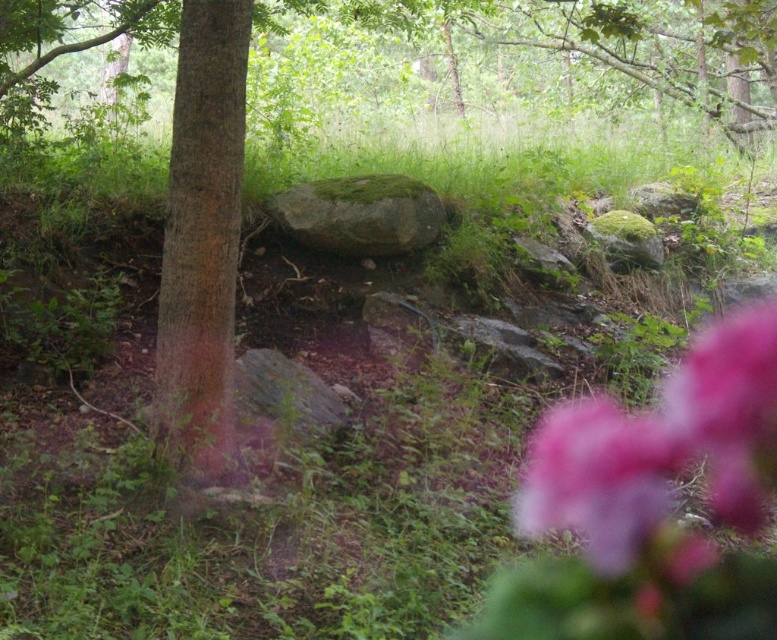
You are a photographer who wants to capture both the pink fuzzy flower at lower right and the pink fluffy flower at lower right in a single frame. Which flower should you focus on to ensure both are in focus?

To ensure both the pink fuzzy flower at lower right and the pink fluffy flower at lower right are in focus, you should focus on the pink fuzzy flower at lower right since it is taller and will require a greater depth of field.

Consider the image. You are a hiker carrying a backpack and want to place your water bottle between the brown rough bark tree at center and the green mossy rock at center. Is there enough space to place it there?

The brown rough bark tree at center and green mossy rock at center are 2.12 meters apart, so yes, there is enough space to place the water bottle between them.

You are a photographer who wants to capture both the pink fuzzy flower at lower right and the brown rough bark tree at center in a single frame. Based on their sizes, which object might require you to adjust your camera angle more to ensure both fit in the shot?

The pink fuzzy flower at lower right might be wider than the brown rough bark tree at center, so you might need to adjust your camera angle more to accommodate its width to ensure both fit in the shot.